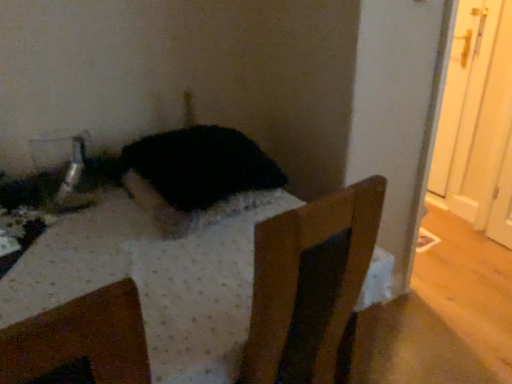
Question: Is black fur cat at center positioned behind wooden chair at center?

Choices:
 (A) yes
 (B) no

Answer: (A)

Question: Considering the relative positions of black fur cat at center and wooden chair at center in the image provided, is black fur cat at center to the left of wooden chair at center from the viewer's perspective?

Choices:
 (A) yes
 (B) no

Answer: (B)

Question: Considering the relative sizes of black fur cat at center and wooden chair at center in the image provided, is black fur cat at center smaller than wooden chair at center?

Choices:
 (A) yes
 (B) no

Answer: (A)

Question: Is black fur cat at center completely or partially outside of wooden chair at center?

Choices:
 (A) yes
 (B) no

Answer: (A)

Question: Is black fur cat at center wider than wooden chair at center?

Choices:
 (A) no
 (B) yes

Answer: (A)

Question: From a real-world perspective, does black fur cat at center stand above wooden chair at center?

Choices:
 (A) no
 (B) yes

Answer: (B)

Question: From a real-world perspective, is wooden chair at center physically above black fur cat at center?

Choices:
 (A) no
 (B) yes

Answer: (A)

Question: Can we say wooden chair at center lies outside black fur cat at center?

Choices:
 (A) yes
 (B) no

Answer: (A)

Question: Is wooden chair at center turned away from black fur cat at center?

Choices:
 (A) no
 (B) yes

Answer: (A)

Question: Is the depth of wooden chair at center greater than that of black fur cat at center?

Choices:
 (A) yes
 (B) no

Answer: (B)

Question: Is wooden chair at center at the right side of black fur cat at center?

Choices:
 (A) yes
 (B) no

Answer: (B)

Question: Considering the relative sizes of wooden chair at center and black fur cat at center in the image provided, is wooden chair at center shorter than black fur cat at center?

Choices:
 (A) no
 (B) yes

Answer: (A)

Question: Considering their positions, is black fur cat at center located in front of or behind wooden chair at center?

Choices:
 (A) front
 (B) behind

Answer: (B)